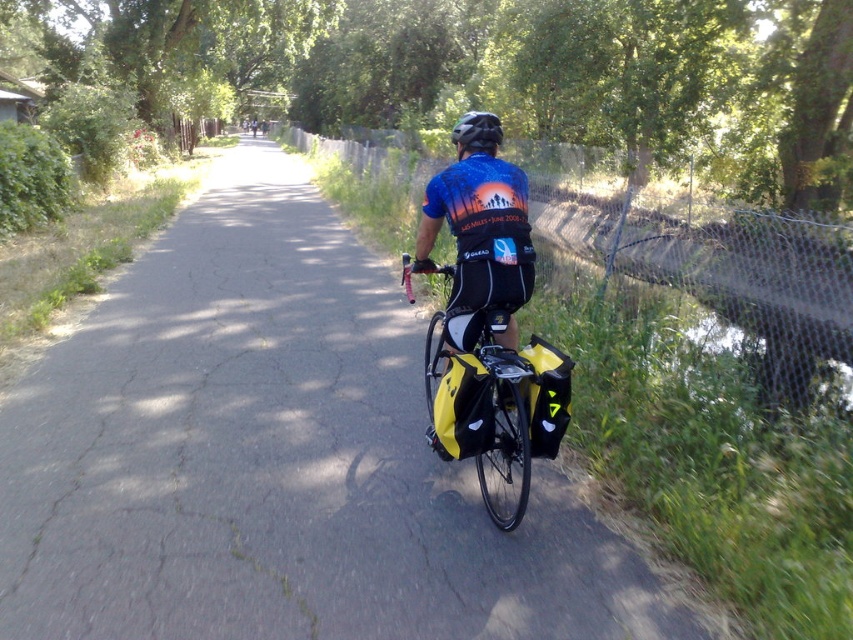
Who is more forward, (666, 637) or (511, 364)?

Point (666, 637) is in front.

Can you confirm if yellow fabric bag at center is positioned to the right of yellow matte bag at center?

In fact, yellow fabric bag at center is to the left of yellow matte bag at center.

At what (x,y) coordinates should I click in order to perform the action: click on yellow fabric bag at center. Please return your answer as a coordinate pair (x, y). This screenshot has height=640, width=853. Looking at the image, I should click on (277, 458).

Can you confirm if yellow fabric bag at center is positioned to the right of matte black helmet at center?

No, yellow fabric bag at center is not to the right of matte black helmet at center.

Find the location of `yellow fabric bag at center`. yellow fabric bag at center is located at coordinates (277, 458).

Which is in front, point (578, 522) or point (473, 138)?

Point (578, 522) is in front.

Locate an element on the screen. yellow fabric bag at center is located at coordinates (277, 458).

Is yellow matte bag at center taller than matte black helmet at center?

No.

Who is higher up, yellow matte bag at center or matte black helmet at center?

matte black helmet at center

The image size is (853, 640). Describe the element at coordinates (482, 401) in the screenshot. I see `yellow matte bag at center` at that location.

This screenshot has width=853, height=640. In order to click on yellow matte bag at center in this screenshot , I will do `click(482, 401)`.